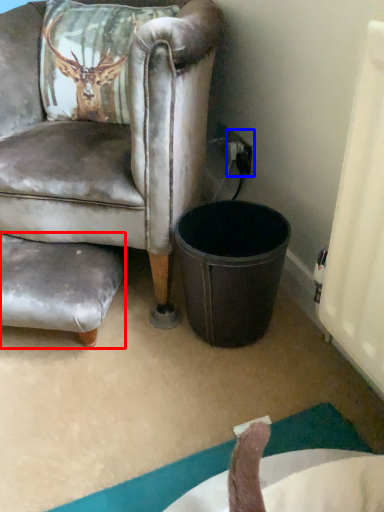
Question: Which object is closer to the camera taking this photo, swivel chair (highlighted by a red box) or power outlet (highlighted by a blue box)?

Choices:
 (A) swivel chair
 (B) power outlet

Answer: (A)